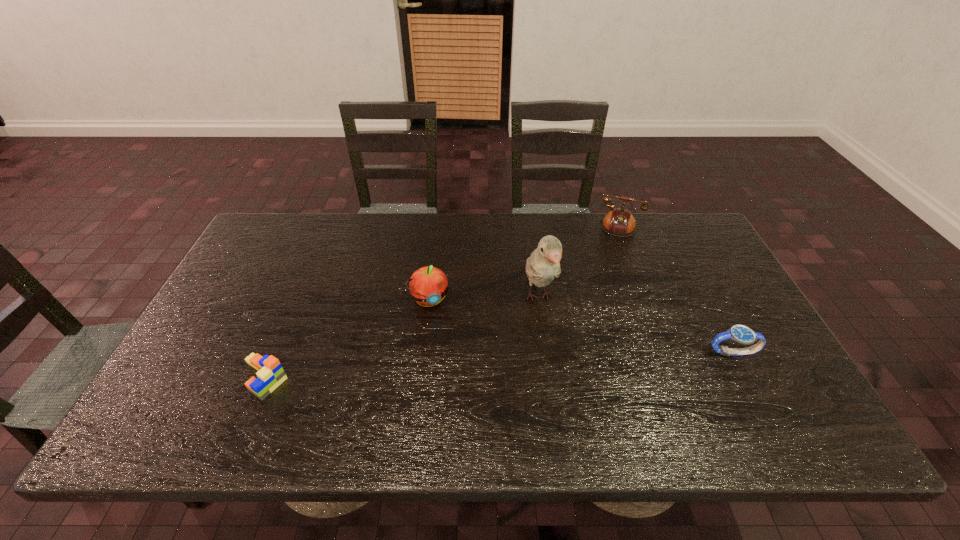
Locate which object ranks fourth in proximity to the rightmost object. Please provide its 2D coordinates. Your answer should be formatted as a tuple, i.e. [(x, y)], where the tuple contains the x and y coordinates of a point satisfying the conditions above.

[(270, 374)]

I want to click on free space that satisfies the following two spatial constraints: 1. on the front side of the watch; 2. on the right side of the farthest object, so click(637, 352).

Find the location of a particular element. The width and height of the screenshot is (960, 540). free space that satisfies the following two spatial constraints: 1. on the back side of the telephone; 2. on the left side of the second object from left to right is located at coordinates (439, 226).

Where is `vacant space that satisfies the following two spatial constraints: 1. on the back side of the watch; 2. on the left side of the Lego`? This screenshot has height=540, width=960. vacant space that satisfies the following two spatial constraints: 1. on the back side of the watch; 2. on the left side of the Lego is located at coordinates (275, 352).

The image size is (960, 540). Identify the location of vacant space that satisfies the following two spatial constraints: 1. on the back side of the tallest object; 2. on the left side of the leftmost object. (298, 298).